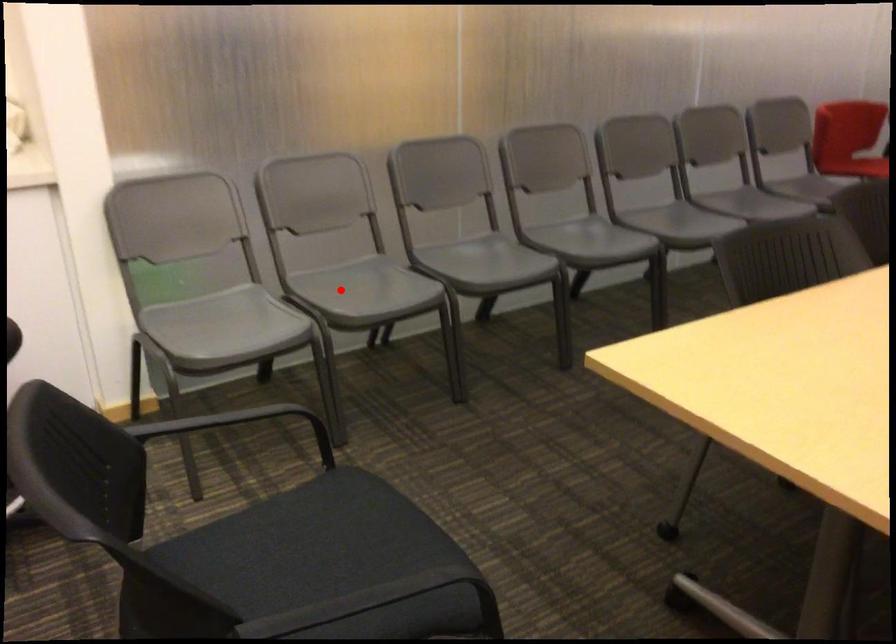
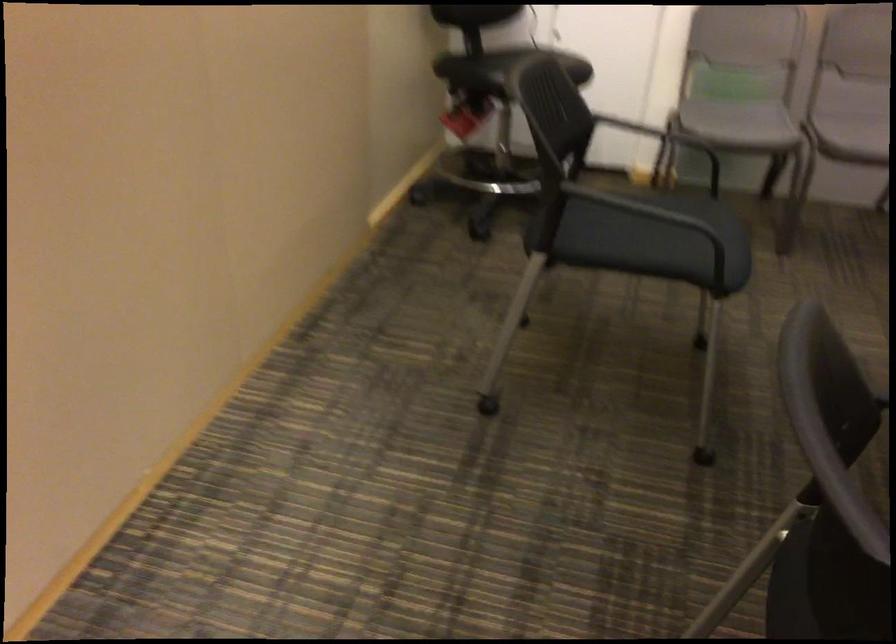
Find the pixel in the second image that matches the highlighted location in the first image.

(853, 128)